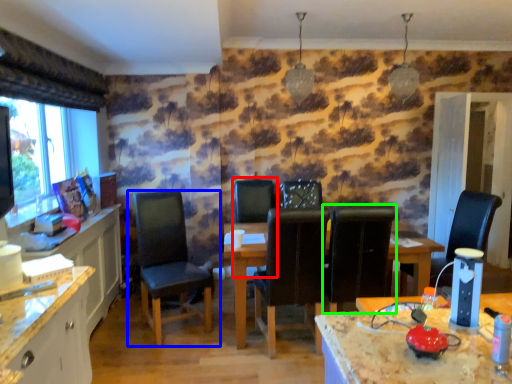
Question: Considering the real-world distances, which object is farthest from armchair (highlighted by a red box)? chair (highlighted by a blue box) or chair (highlighted by a green box)?

Choices:
 (A) chair
 (B) chair

Answer: (B)